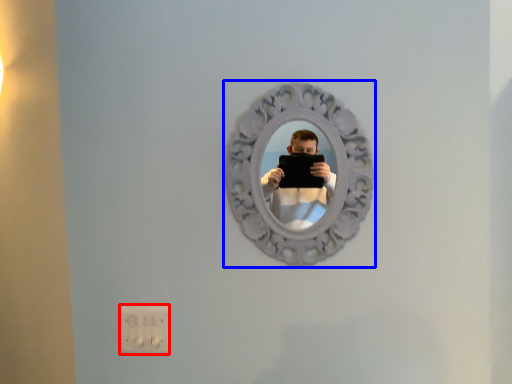
Question: Which of the following is the farthest to the observer, electric outlet (highlighted by a red box) or view mirror (highlighted by a blue box)?

Choices:
 (A) electric outlet
 (B) view mirror

Answer: (A)